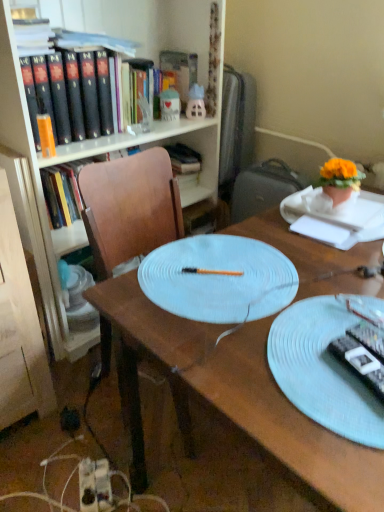
Image resolution: width=384 pixels, height=512 pixels. Describe the element at coordinates (196, 102) in the screenshot. I see `matte pink plastic toy at upper center, which is counted as the first toy, starting from the right` at that location.

Identify the location of black plastic remote control at lower right, the 1th remote control positioned from the left. The image size is (384, 512). (360, 362).

The height and width of the screenshot is (512, 384). What do you see at coordinates (231, 397) in the screenshot? I see `wooden desk at center` at bounding box center [231, 397].

What do you see at coordinates (323, 370) in the screenshot?
I see `light blue textured plate at center` at bounding box center [323, 370].

Describe the element at coordinates (340, 179) in the screenshot. I see `orange fabric flower pot at upper right` at that location.

What are the coordinates of `hardcover book at upper center` in the screenshot? It's located at (184, 159).

At what (x,y) coordinates should I click in order to perform the action: click on matte wood bookcase at upper left. Please return your answer as a coordinate pair (x, y). This screenshot has width=384, height=512. Looking at the image, I should click on (117, 111).

Image resolution: width=384 pixels, height=512 pixels. In order to click on matte pink plastic toy at upper center, which is counted as the first toy, starting from the right in this screenshot , I will do `click(196, 102)`.

How many degrees apart are the facing directions of wooden desk at center and light blue textured plate at center?

They differ by 91.1 degrees in their facing directions.

Does wooden desk at center have a greater width compared to light blue textured plate at center?

Yes, wooden desk at center is wider than light blue textured plate at center.

Is wooden desk at center not close to light blue textured plate at center?

They are positioned close to each other.

Which object is further away from the camera taking this photo, wooden desk at center or light blue textured plate at center?

light blue textured plate at center is behind.

Looking at this image, could you tell me if light blue textured plate at center is facing matte pink plastic toy at upper center, the second toy positioned from the left?

No, light blue textured plate at center is not aimed at matte pink plastic toy at upper center, the second toy positioned from the left.

Which is in front, light blue textured plate at center or matte pink plastic toy at upper center, the second toy positioned from the left?

light blue textured plate at center is closer to the camera.

From a real-world perspective, is light blue textured plate at center physically located above or below matte pink plastic toy at upper center, the second toy positioned from the left?

In terms of real-world spatial position, light blue textured plate at center is below matte pink plastic toy at upper center, the second toy positioned from the left.

Between light blue textured plate at center and matte pink plastic toy at upper center, which is counted as the first toy, starting from the right, which one appears on the right side from the viewer's perspective?

light blue textured plate at center.

Can you confirm if hardcover book at upper center is wider than matte wood bookcase at upper left?

Incorrect, the width of hardcover book at upper center does not surpass that of matte wood bookcase at upper left.

From the image's perspective, which object appears higher, hardcover book at upper center or matte wood bookcase at upper left?

hardcover book at upper center is shown above in the image.

Which point is more forward, (194,156) or (212,15)?

Positioned in front is point (212,15).

Who is taller, hardcover book at upper center or matte wood bookcase at upper left?

Standing taller between the two is matte wood bookcase at upper left.

Is point (363, 338) positioned before point (175, 170)?

Yes, point (363, 338) is closer to viewer.

Is hardcover book at upper center at the back of black plastic remote control at right, arranged as the 2th remote control when viewed from the left?

No, black plastic remote control at right, arranged as the 2th remote control when viewed from the left, is not facing away from hardcover book at upper center.

Is black plastic remote control at right, arranged as the 2th remote control when viewed from the left, bigger than hardcover book at upper center?

No, black plastic remote control at right, arranged as the 2th remote control when viewed from the left, is not bigger than hardcover book at upper center.

Where is `book that is behind the black plastic remote control at right, arranged as the 2th remote control when viewed from the left`? This screenshot has height=512, width=384. book that is behind the black plastic remote control at right, arranged as the 2th remote control when viewed from the left is located at coordinates (184, 159).

Is point (356, 338) more distant than point (253, 422)?

That is True.

Does black plastic remote control at right, the first remote control from the right, have a smaller size compared to wooden desk at center?

Indeed, black plastic remote control at right, the first remote control from the right, has a smaller size compared to wooden desk at center.

In the image, there is a black plastic remote control at right, arranged as the 2th remote control when viewed from the left. Identify the location of desk below it (from a real-world perspective). [231, 397].

From a real-world perspective, who is located lower, black plastic remote control at right, arranged as the 2th remote control when viewed from the left, or wooden desk at center?

In real-world perspective, wooden desk at center is lower.

Is wooden desk at center facing towards orange fabric flower pot at upper right?

No, wooden desk at center is not turned towards orange fabric flower pot at upper right.

Can you confirm if wooden desk at center is shorter than orange fabric flower pot at upper right?

No.

I want to click on desk on the left of orange fabric flower pot at upper right, so click(231, 397).

Is light blue textured plate at center shorter than matte plastic toy at upper center, placed as the first toy when sorted from left to right?

Indeed, light blue textured plate at center has a lesser height compared to matte plastic toy at upper center, placed as the first toy when sorted from left to right.

From a real-world perspective, between light blue textured plate at center and matte plastic toy at upper center, placed as the first toy when sorted from left to right, who is vertically lower?

In real-world perspective, light blue textured plate at center is lower.

Is light blue textured plate at center oriented towards matte plastic toy at upper center, placed as the first toy when sorted from left to right?

No, light blue textured plate at center does not turn towards matte plastic toy at upper center, placed as the first toy when sorted from left to right.

Is matte plastic toy at upper center, placed as the first toy when sorted from left to right, completely or partially inside light blue textured plate at center?

No.

Locate an element on the screen. Image resolution: width=384 pixels, height=512 pixels. desk below the light blue textured plate at center (from the image's perspective) is located at coordinates (231, 397).

Starting from the light blue textured plate at center, which toy is the 2nd one behind? Please provide its 2D coordinates.

[(196, 102)]

Considering their positions, is light blue textured plate at center positioned closer to black plastic remote control at lower right, the 1th remote control positioned from the left, than orange fabric flower pot at upper right?

light blue textured plate at center.

Looking at the image, which one is located closer to matte wood bookcase at upper left, wooden desk at center or black plastic remote control at lower right, the 1th remote control positioned from the left?

wooden desk at center is positioned closer to the anchor matte wood bookcase at upper left.

Considering their positions, is matte pink plastic toy at upper center, the second toy positioned from the left, positioned further to matte wood bookcase at upper left than light blue textured plate at center?

Among the two, light blue textured plate at center is located further to matte wood bookcase at upper left.

When comparing their distances from black plastic remote control at lower right, the 1th remote control positioned from the left, does black plastic remote control at right, the first remote control from the right, or matte pink plastic toy at upper center, the second toy positioned from the left, seem closer?

The object closer to black plastic remote control at lower right, the 1th remote control positioned from the left, is black plastic remote control at right, the first remote control from the right.

From the image, which object appears to be farther from orange fabric flower pot at upper right, black plastic remote control at lower right, which appears as the second remote control when viewed from the right, or hardcover book at upper center?

hardcover book at upper center is positioned further to the anchor orange fabric flower pot at upper right.

Estimate the real-world distances between objects in this image. Which object is closer to black plastic remote control at right, arranged as the 2th remote control when viewed from the left, wooden desk at center or black plastic remote control at lower right, which appears as the second remote control when viewed from the right?

black plastic remote control at lower right, which appears as the second remote control when viewed from the right, is closer to black plastic remote control at right, arranged as the 2th remote control when viewed from the left.

From the picture: Estimate the real-world distances between objects in this image. Which object is further from black plastic remote control at lower right, which appears as the second remote control when viewed from the right, light blue textured plate at center or wooden desk at center?

wooden desk at center is further to black plastic remote control at lower right, which appears as the second remote control when viewed from the right.

Considering their positions, is matte plastic toy at upper center, the second toy when ordered from right to left, positioned closer to black plastic remote control at right, arranged as the 2th remote control when viewed from the left, than hardcover book at upper center?

Among the two, matte plastic toy at upper center, the second toy when ordered from right to left, is located nearer to black plastic remote control at right, arranged as the 2th remote control when viewed from the left.

Identify the location of houseplant located between black plastic remote control at right, arranged as the 2th remote control when viewed from the left, and matte plastic toy at upper center, the second toy when ordered from right to left, in the depth direction. (340, 179).

Find the location of a particular element. The image size is (384, 512). bookcase positioned between black plastic remote control at lower right, which appears as the second remote control when viewed from the right, and hardcover book at upper center from near to far is located at coordinates (117, 111).

You are a GUI agent. You are given a task and a screenshot of the screen. Output one action in this format:
    pyautogui.click(x=<x>, y=<y>)
    Task: Click on the bookcase positioned between light blue textured plate at center and matte pink plastic toy at upper center, the second toy positioned from the left, from near to far
    
    Given the screenshot: What is the action you would take?
    pyautogui.click(x=117, y=111)

Locate an element on the screen. houseplant between light blue textured plate at center and hardcover book at upper center along the z-axis is located at coordinates (340, 179).